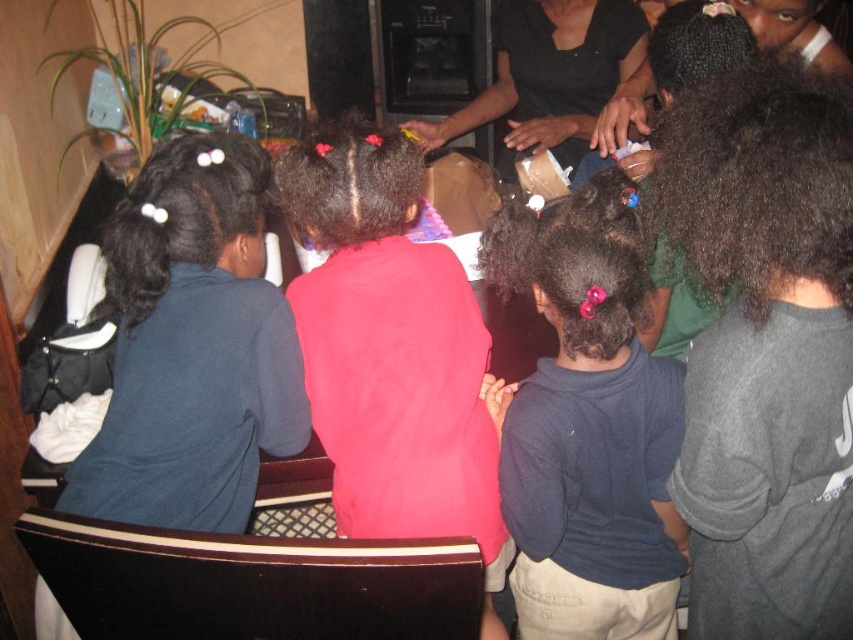
You are a photographer at a family gathering and need to ensure both the matte pink shirt at center and dark blue shirt at center are clearly visible in your photo. Given their sizes, which shirt might you need to position closer to the camera to ensure both are equally visible?

The matte pink shirt at center is larger in size than the dark blue shirt at center. To ensure both are equally visible, you might position the smaller dark blue shirt at center closer to the camera so it appears the same size as the larger matte pink shirt at center in the photo.